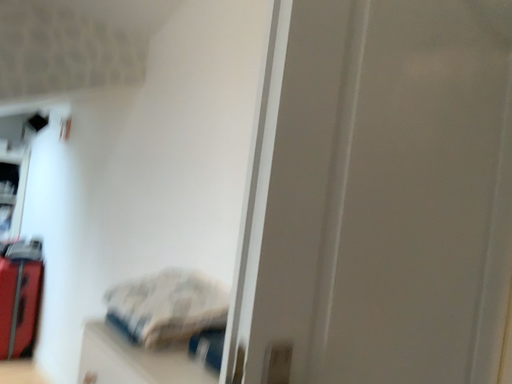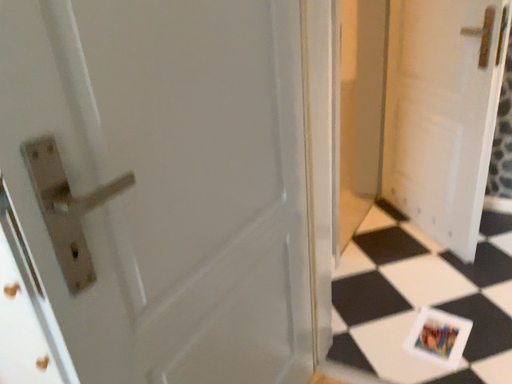
Question: How did the camera likely rotate when shooting the video?

Choices:
 (A) rotated upward
 (B) rotated downward

Answer: (B)